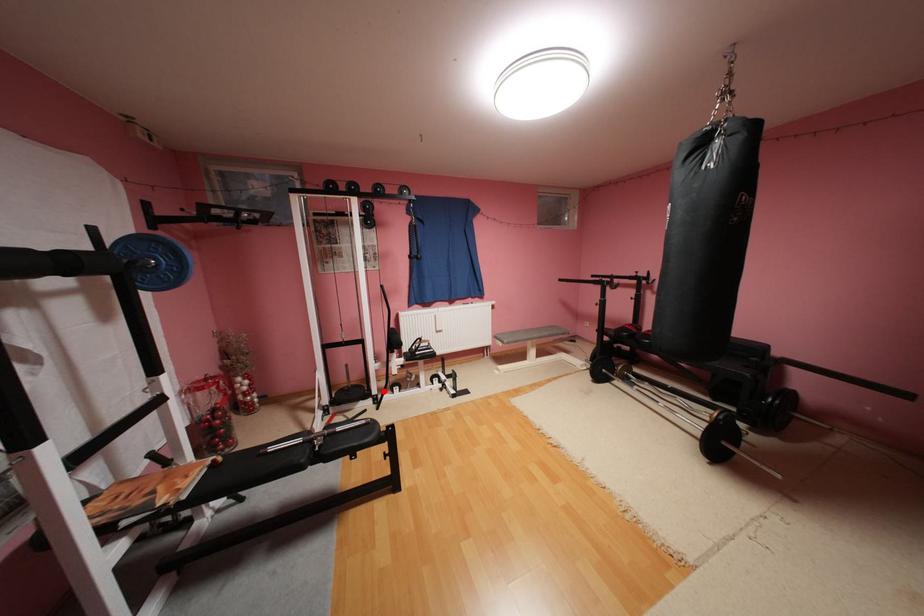
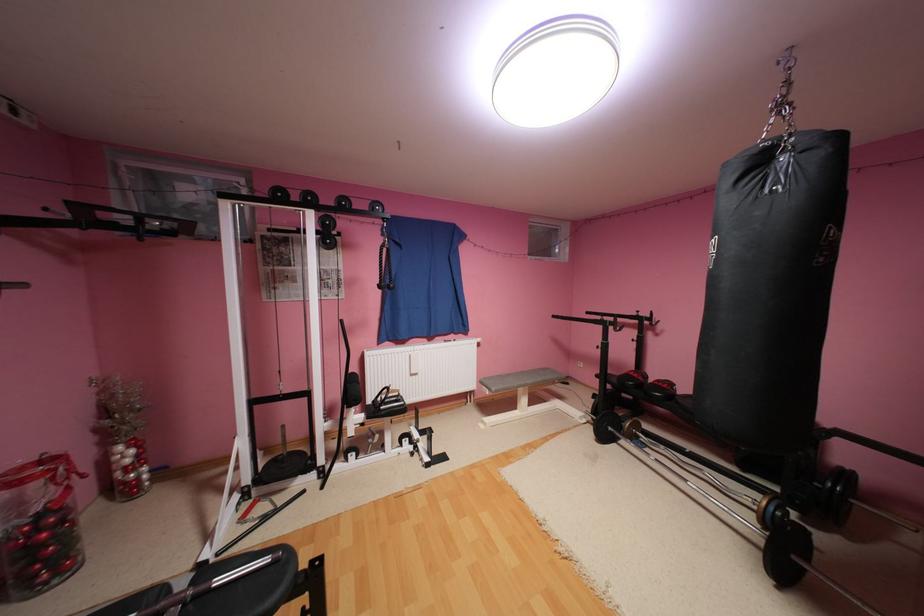
Find the pixel in the second image that matches the highlighted location in the first image.

(331, 460)